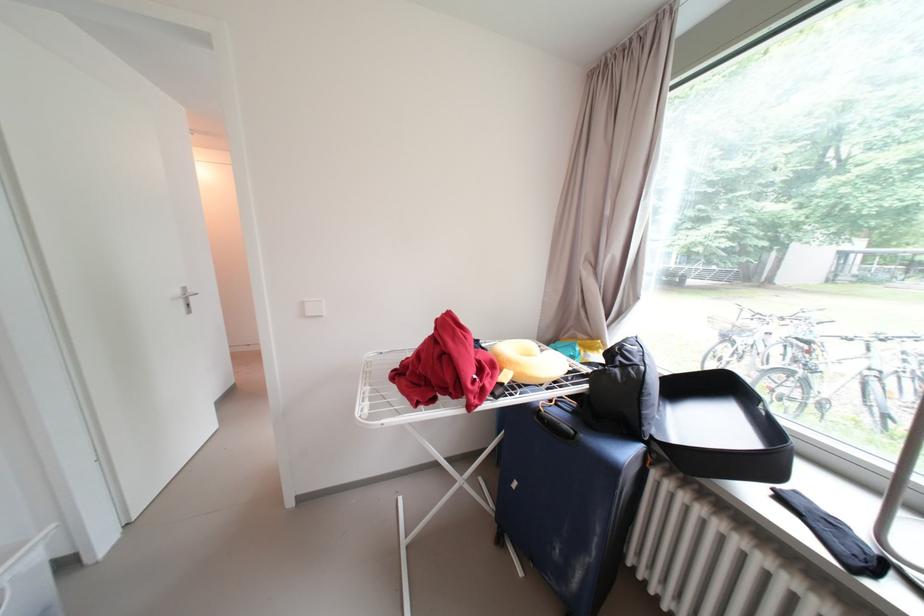
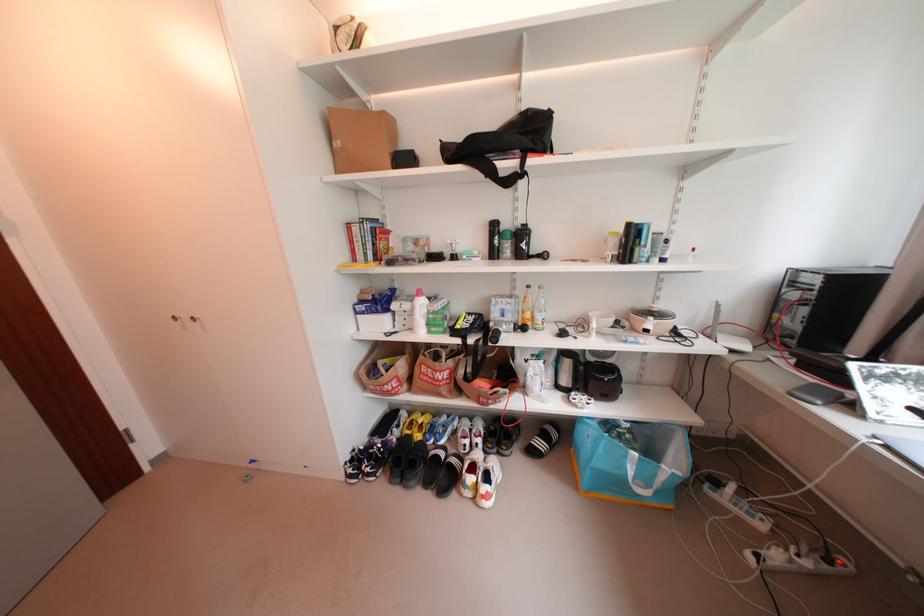
In a continuous first-person perspective shot, in which direction is the camera moving?

The movement direction of the cameraman is left, forward.